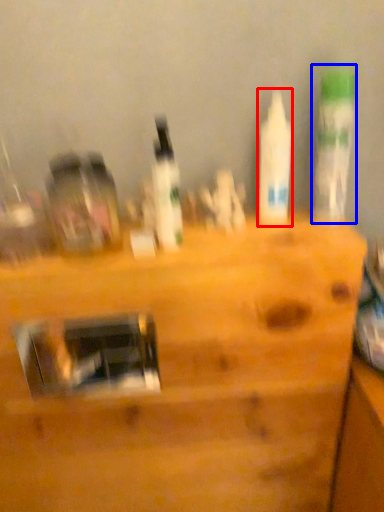
Question: Which object appears farthest to the camera in this image, bottle (highlighted by a red box) or bottle (highlighted by a blue box)?

Choices:
 (A) bottle
 (B) bottle

Answer: (A)